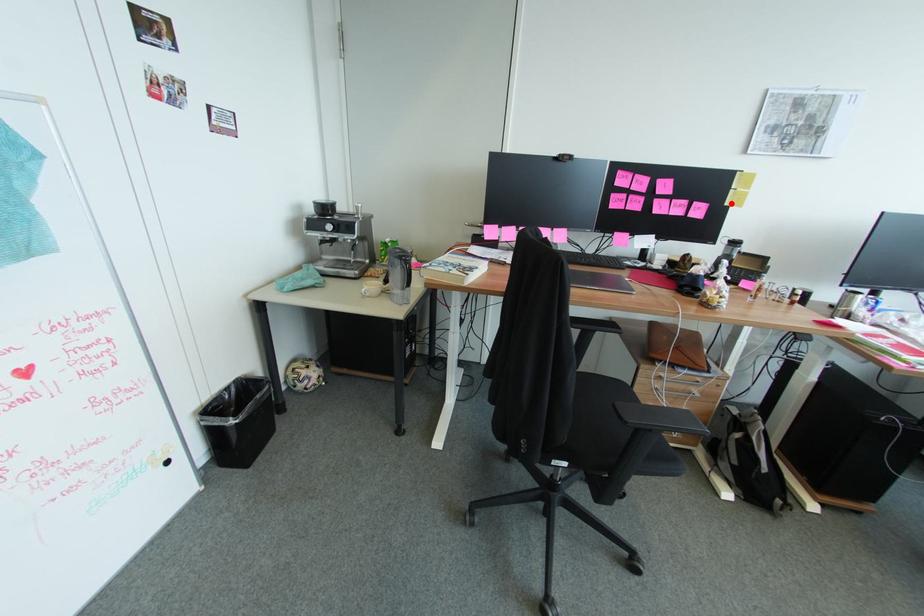
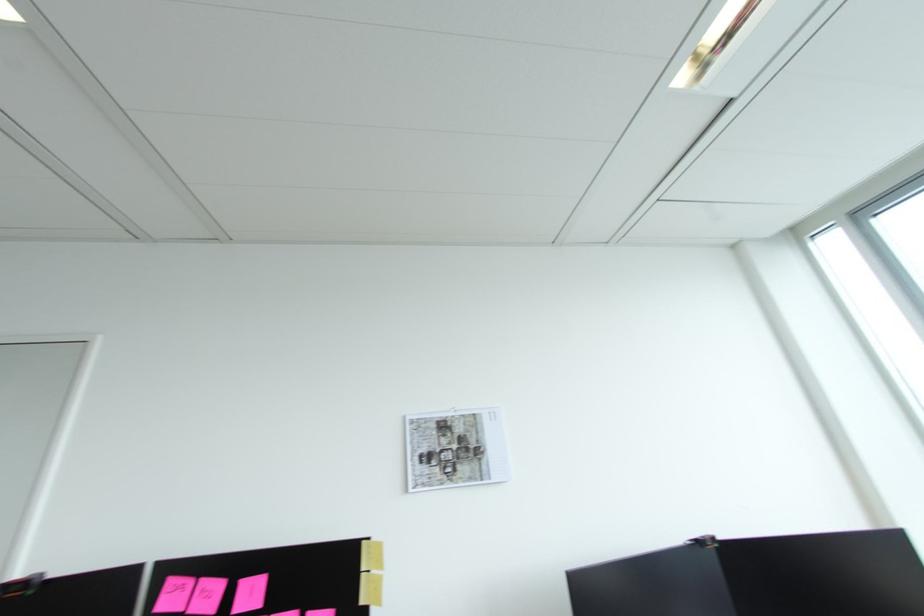
Find the pixel in the second image that matches the highlighted location in the first image.

(366, 602)